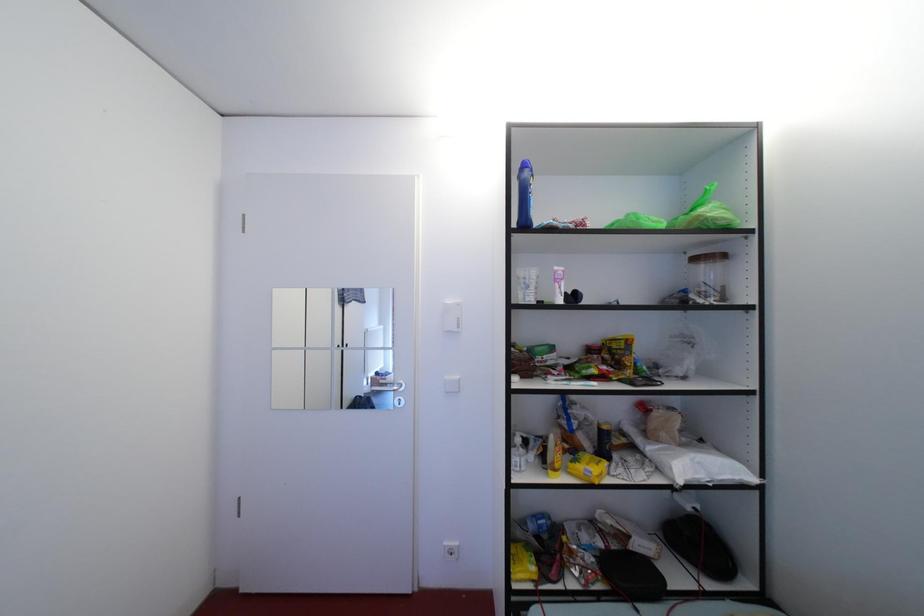
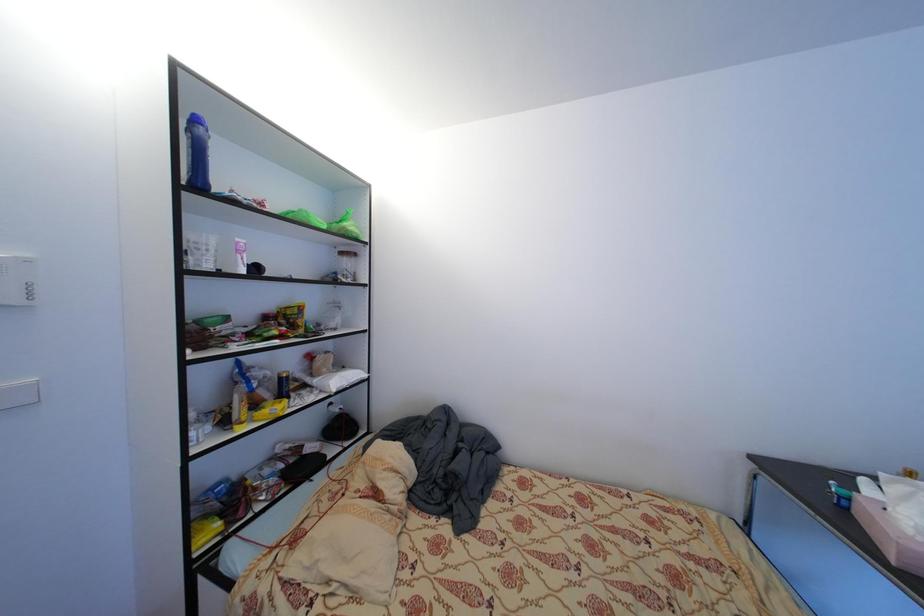
Question: The camera is either moving clockwise (left) or counter-clockwise (right) around the object. The first image is from the beginning of the video and the second image is from the end. Is the camera moving left or right when shooting the video?

Choices:
 (A) Left
 (B) Right

Answer: (A)